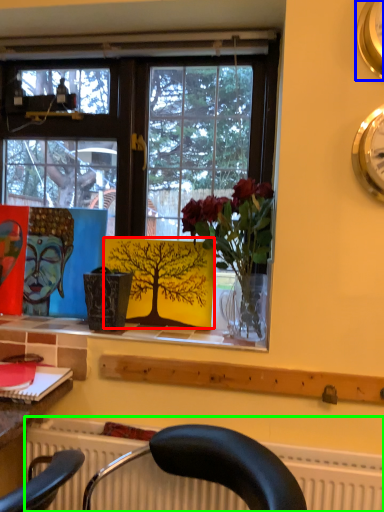
Question: Which object is the farthest from plant (highlighted by a red box)? Choose among these: clock (highlighted by a blue box) or radiator (highlighted by a green box).

Choices:
 (A) clock
 (B) radiator

Answer: (A)